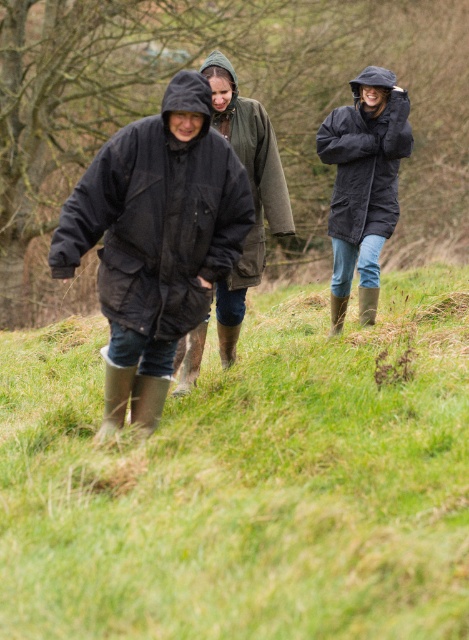
Does black matte jacket at left appear on the right side of matte black jacket at center?

Incorrect, black matte jacket at left is not on the right side of matte black jacket at center.

Is point (67, 205) closer to camera compared to point (213, 109)?

That is True.

Image resolution: width=469 pixels, height=640 pixels. In order to click on black matte jacket at left in this screenshot , I will do `click(158, 218)`.

Does black matte jacket at left appear under black waterproof jacket at upper right?

Yes, black matte jacket at left is below black waterproof jacket at upper right.

Is black matte jacket at left to the left of black waterproof jacket at upper right from the viewer's perspective?

Correct, you'll find black matte jacket at left to the left of black waterproof jacket at upper right.

Does point (100, 285) come closer to viewer compared to point (371, 141)?

Yes, it is in front of point (371, 141).

The width and height of the screenshot is (469, 640). I want to click on black matte jacket at left, so click(158, 218).

Does matte black jacket at center have a greater width compared to black waterproof jacket at upper right?

Correct, the width of matte black jacket at center exceeds that of black waterproof jacket at upper right.

Is point (211, 83) positioned in front of point (378, 205)?

Yes.

Who is more forward, (179,348) or (334,212)?

Point (179,348) is more forward.

You are a GUI agent. You are given a task and a screenshot of the screen. Output one action in this format:
    pyautogui.click(x=<x>, y=<y>)
    Task: Click on the matte black jacket at center
    
    Given the screenshot: What is the action you would take?
    tap(251, 193)